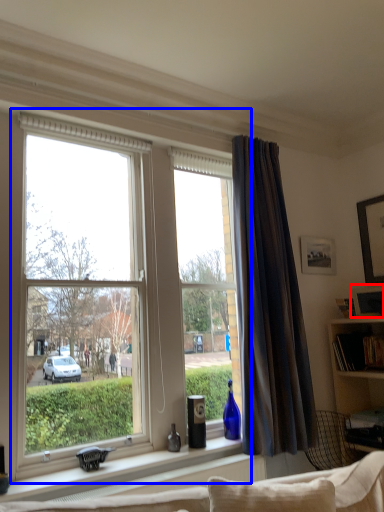
Question: Which object is further to the camera taking this photo, picture frame (highlighted by a red box) or window (highlighted by a blue box)?

Choices:
 (A) picture frame
 (B) window

Answer: (A)